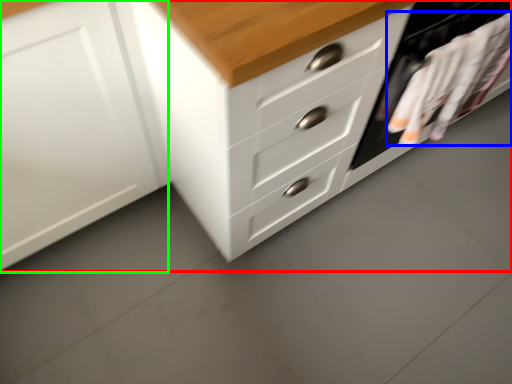
Question: Estimate the real-world distances between objects in this image. Which object is farther from chest of drawers (highlighted by a red box), laundry (highlighted by a blue box) or cabinetry (highlighted by a green box)?

Choices:
 (A) laundry
 (B) cabinetry

Answer: (A)